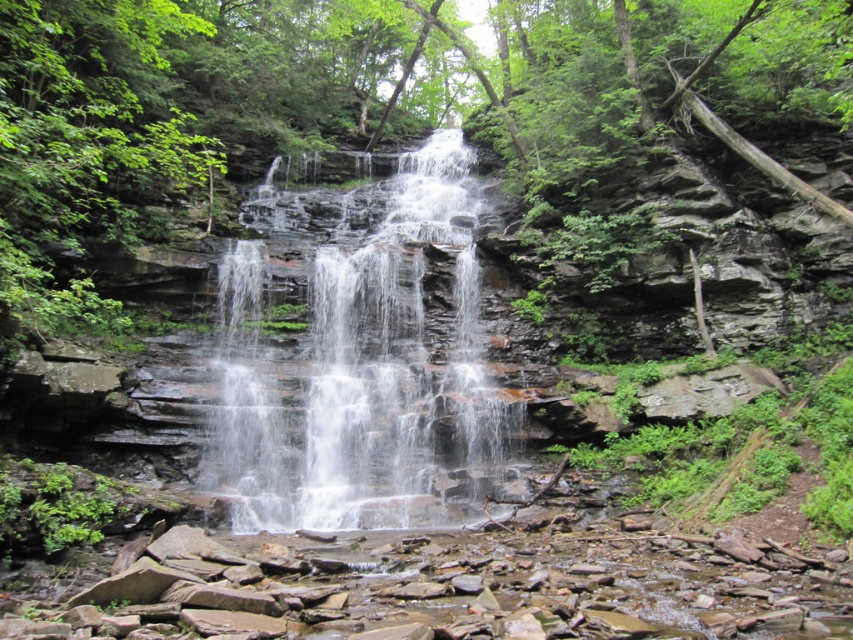
Who is more distant from viewer, (199, 33) or (416, 465)?

The point (199, 33) is more distant.

Who is more forward, (25,49) or (387,340)?

Positioned in front is point (25,49).

Find the location of `green leafy forest at center`. green leafy forest at center is located at coordinates (352, 100).